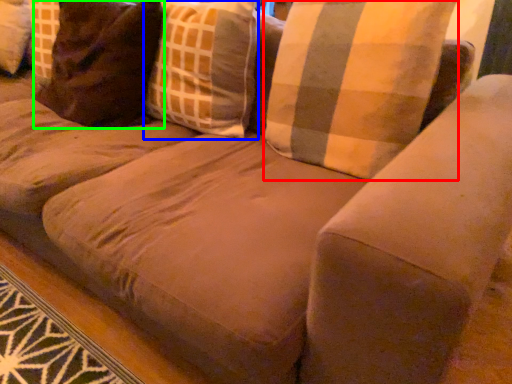
Question: Which object is the closest to the pillow (highlighted by a red box)? Choose among these: throw pillow (highlighted by a blue box) or pillow (highlighted by a green box).

Choices:
 (A) throw pillow
 (B) pillow

Answer: (A)